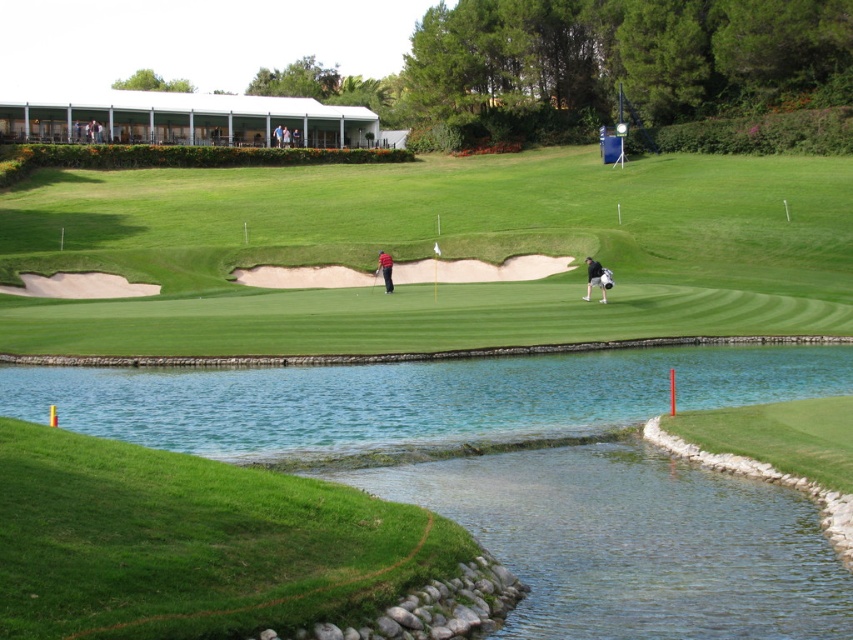
You are a golfer who just finished your swing and need to retrieve your equipment. You see the black fabric golf bag at center and the glossy wood golf club at center. Which item will require more space to store properly?

The black fabric golf bag at center is larger in size than the glossy wood golf club at center, so it will require more space to store properly.

You are a golfer who just hit a ball onto the green grassy golf course at center and the red matte golf club at center. Which object takes up more space in the image?

The green grassy golf course at center takes up more space in the image because it is larger in size than the red matte golf club at center.